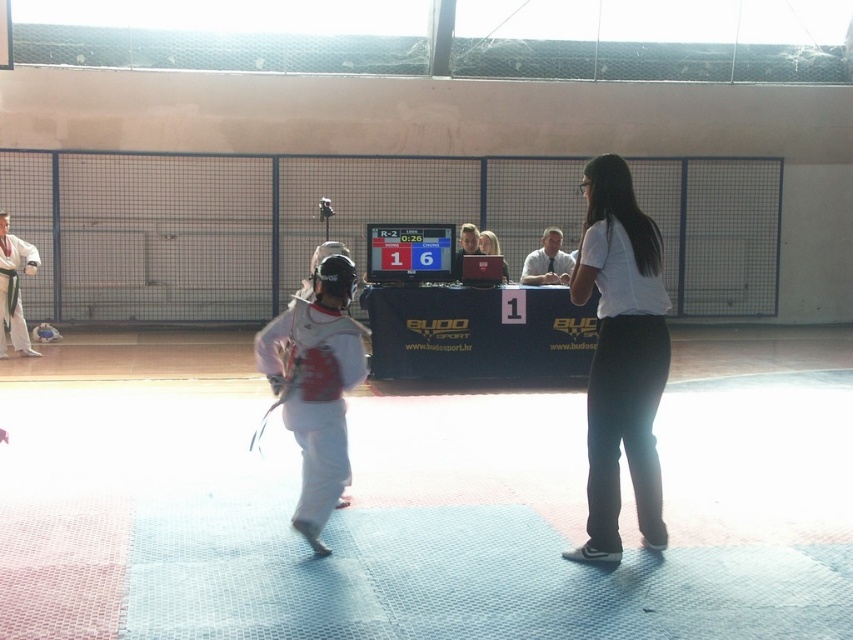
Question: Which of the following is the farthest from the observer?

Choices:
 (A) (608, 240)
 (B) (480, 232)
 (C) (26, 337)
 (D) (553, 260)

Answer: (B)

Question: Which point is closer to the camera?

Choices:
 (A) (334, 355)
 (B) (35, 253)

Answer: (A)

Question: Is white matte shirt at center to the left of white matte karate uniform at left from the viewer's perspective?

Choices:
 (A) no
 (B) yes

Answer: (A)

Question: Which is farther from the matte white shirt at center?

Choices:
 (A) white shirt at center
 (B) white matte karate uniform at center
 (C) white matte shirt at center
 (D) white matte karate uniform at left

Answer: (D)

Question: Is white matte karate uniform at center above white matte karate uniform at left?

Choices:
 (A) no
 (B) yes

Answer: (A)

Question: Is white matte karate uniform at center bigger than white matte karate uniform at left?

Choices:
 (A) no
 (B) yes

Answer: (A)